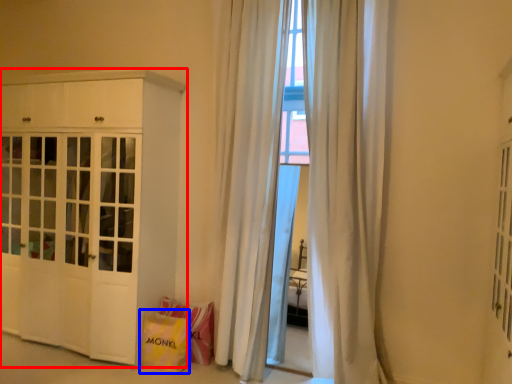
Question: Which object appears closest to the camera in this image, cabinetry (highlighted by a red box) or shopping bag (highlighted by a blue box)?

Choices:
 (A) cabinetry
 (B) shopping bag

Answer: (A)